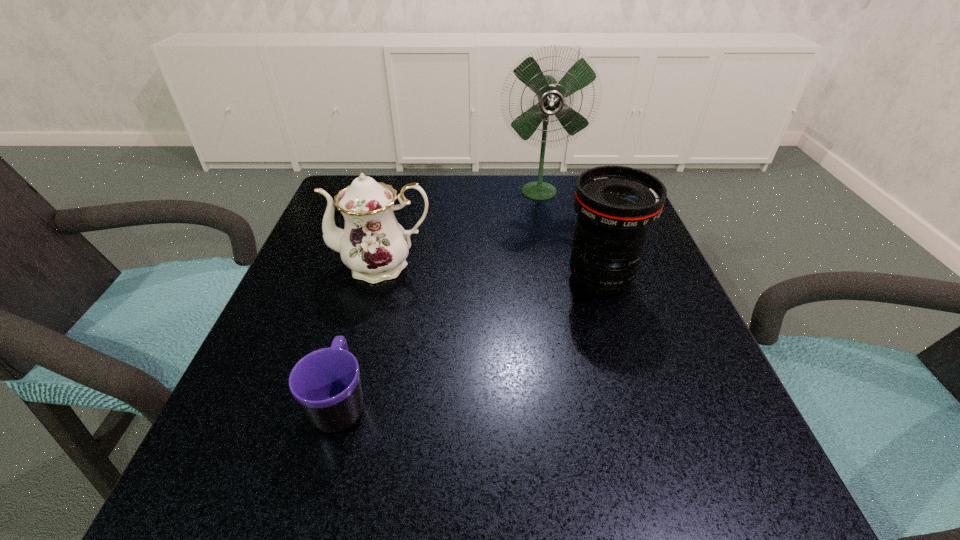
This screenshot has height=540, width=960. What are the coordinates of `vacant region at the left edge of the desktop` in the screenshot? It's located at (353, 329).

This screenshot has width=960, height=540. I want to click on vacant space at the right edge of the desktop, so click(646, 331).

This screenshot has height=540, width=960. I want to click on vacant space in between the fan and the nearest object, so click(x=440, y=296).

Find the location of `empty space between the telephoto lens and the tallest object`. empty space between the telephoto lens and the tallest object is located at coordinates (569, 235).

The height and width of the screenshot is (540, 960). I want to click on free point between the chinaware and the nearest object, so click(x=362, y=334).

The height and width of the screenshot is (540, 960). What are the coordinates of `free space between the shortest object and the chinaware` in the screenshot? It's located at (362, 334).

This screenshot has width=960, height=540. Find the location of `free area in between the nearest object and the farthest object`. free area in between the nearest object and the farthest object is located at coordinates (440, 296).

You are a GUI agent. You are given a task and a screenshot of the screen. Output one action in this format:
    pyautogui.click(x=<x>, y=<y>)
    Task: Click on the vacant area between the chinaware and the telephoto lens
    
    Given the screenshot: What is the action you would take?
    pyautogui.click(x=492, y=272)

At what (x,y) coordinates should I click in order to perform the action: click on empty space that is in between the fan and the chinaware. Please return your answer as a coordinate pair (x, y). Looking at the image, I should click on (461, 228).

The height and width of the screenshot is (540, 960). What are the coordinates of `vacant area that lies between the tallest object and the telephoto lens` in the screenshot? It's located at (569, 235).